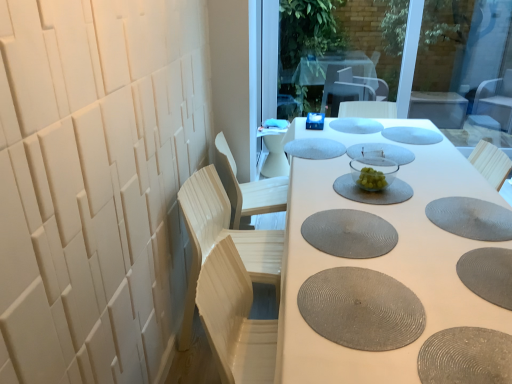
Where is `free spot above clear glass bowl at center, which is counted as the 5th manhole cover, starting from the back (from a real-world perspective)`? free spot above clear glass bowl at center, which is counted as the 5th manhole cover, starting from the back (from a real-world perspective) is located at coordinates (364, 183).